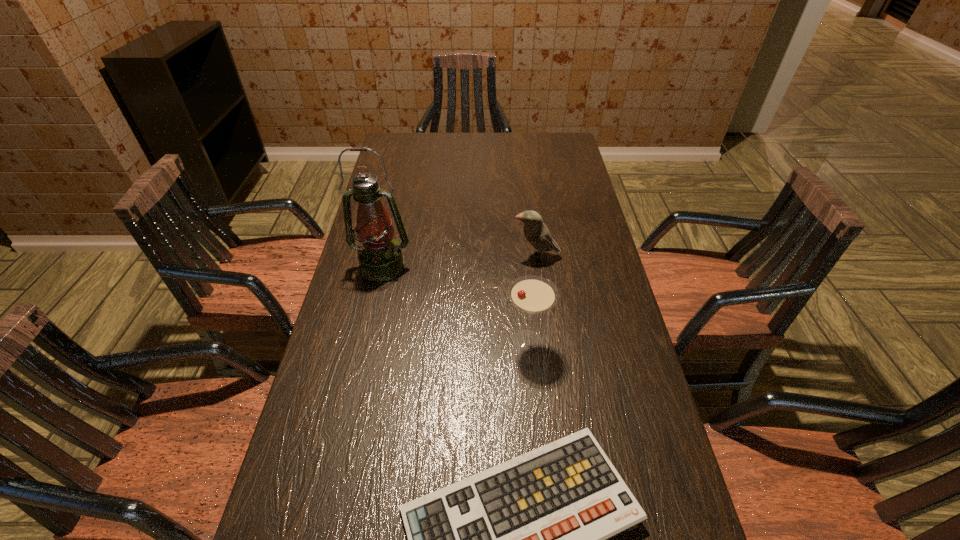
You are a GUI agent. You are given a task and a screenshot of the screen. Output one action in this format:
    pyautogui.click(x=<x>, y=<y>)
    Task: Click on the object located in the right edge section of the desktop
    This screenshot has width=960, height=540.
    Given the screenshot: What is the action you would take?
    536,232

Where is `vacant region at the far edge`? vacant region at the far edge is located at coordinates (468, 155).

Where is `vacant space at the left edge of the desktop`? This screenshot has height=540, width=960. vacant space at the left edge of the desktop is located at coordinates (357, 400).

This screenshot has width=960, height=540. What are the coordinates of `vacant region at the right edge of the desktop` in the screenshot? It's located at [569, 201].

I want to click on empty space between the bird and the leftmost object, so click(x=459, y=261).

This screenshot has width=960, height=540. I want to click on empty location between the oil lamp and the martini, so click(455, 303).

Image resolution: width=960 pixels, height=540 pixels. Identify the location of vacant area that lies between the martini and the tallest object. (455, 303).

The height and width of the screenshot is (540, 960). What are the coordinates of `object that is the closest to the leftmost object` in the screenshot? It's located at (536, 232).

Locate an element on the screen. object that ranks as the closest to the shortest object is located at coordinates (532, 294).

Identify the location of vacant region that satisfies the following two spatial constraints: 1. at the face of the bird; 2. on the front side of the third farthest object. The image size is (960, 540). (547, 341).